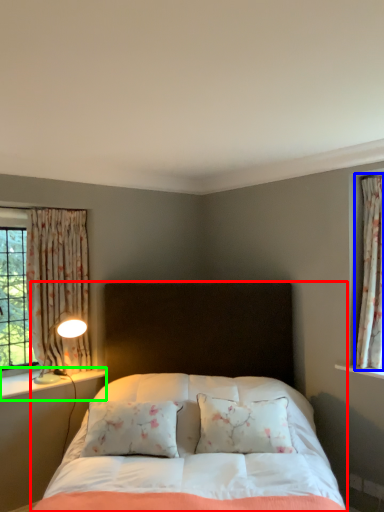
Question: Which is farther away from bed (highlighted by a red box)? curtain (highlighted by a blue box) or window sill (highlighted by a green box)?

Choices:
 (A) curtain
 (B) window sill

Answer: (A)